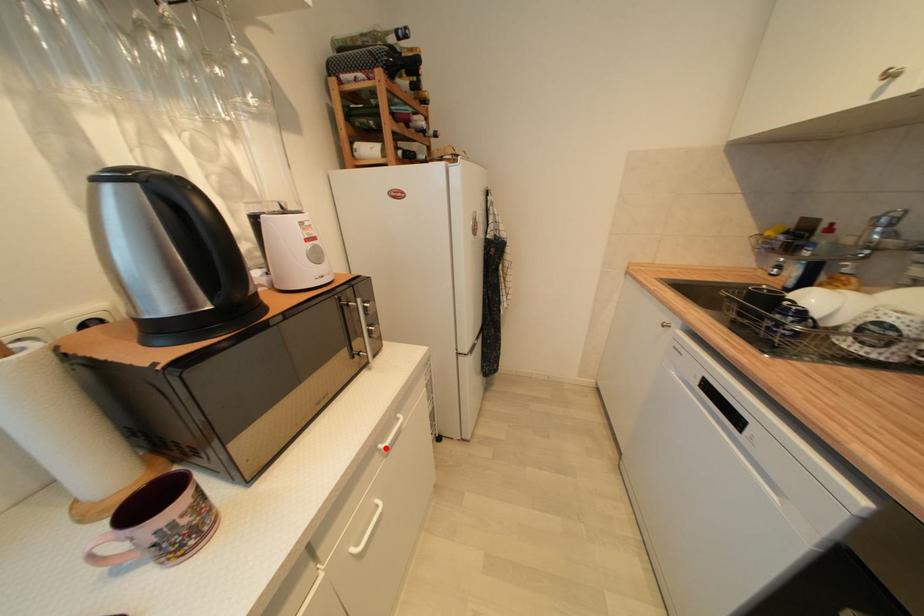
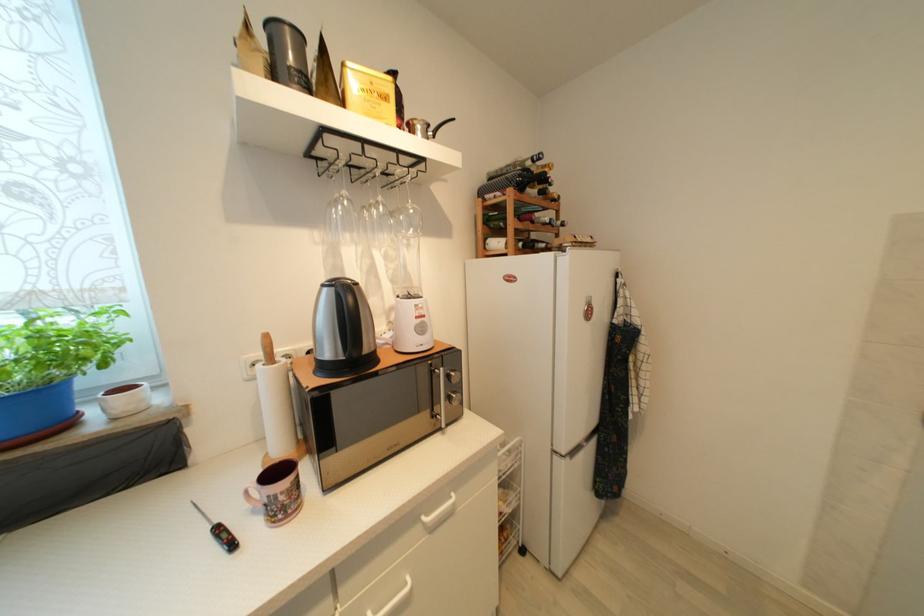
The point at the highlighted location is marked in the first image. Where is the corresponding point in the second image?

(429, 521)